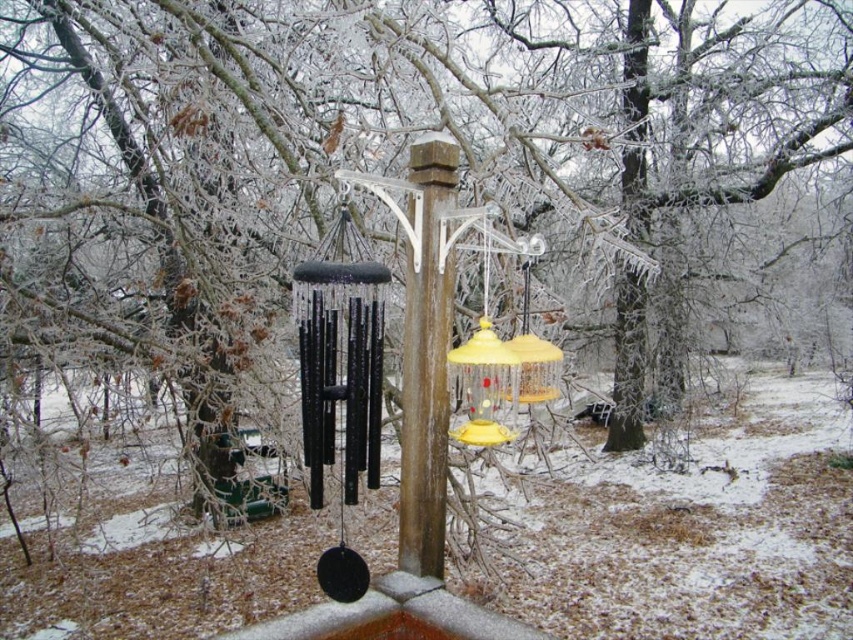
You are standing in the winter backyard and notice the black metallic wind chime at center and the brown wood post at center. Which object is shorter in height?

The black metallic wind chime at center is shorter than the brown wood post at center.

You are standing in the winter backyard scene. You want to hang a new decorative item exactly where the black metallic wind chime at center is currently located. What are the coordinates you should aim for?

The coordinates for the black metallic wind chime at center are at point [340,381].

Based on the coordinates provided, which object is located at point (340,381)?

The point (340,381) marks the location of the black metallic wind chime at center.